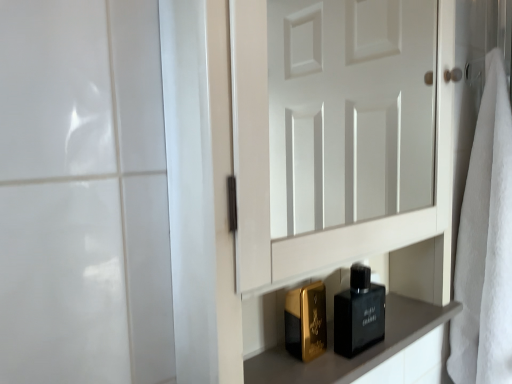
Question: From the image's perspective, is matte black perfume bottles at lower center beneath white soft towel at right?

Choices:
 (A) yes
 (B) no

Answer: (A)

Question: From a real-world perspective, does matte black perfume bottles at lower center sit lower than white soft towel at right?

Choices:
 (A) no
 (B) yes

Answer: (B)

Question: Is matte black perfume bottles at lower center facing away from white soft towel at right?

Choices:
 (A) no
 (B) yes

Answer: (A)

Question: Is matte black perfume bottles at lower center thinner than white soft towel at right?

Choices:
 (A) yes
 (B) no

Answer: (A)

Question: Considering the relative sizes of matte black perfume bottles at lower center and white soft towel at right in the image provided, is matte black perfume bottles at lower center shorter than white soft towel at right?

Choices:
 (A) no
 (B) yes

Answer: (B)

Question: Is matte black perfume bottles at lower center closer to camera compared to white soft towel at right?

Choices:
 (A) no
 (B) yes

Answer: (B)

Question: Is matte black perfume bottles at lower center further to camera compared to black glass perfume at lower center?

Choices:
 (A) yes
 (B) no

Answer: (B)

Question: Is the position of matte black perfume bottles at lower center less distant than that of black glass perfume at lower center?

Choices:
 (A) no
 (B) yes

Answer: (B)

Question: Is matte black perfume bottles at lower center positioned beyond the bounds of black glass perfume at lower center?

Choices:
 (A) no
 (B) yes

Answer: (B)

Question: Is matte black perfume bottles at lower center far from black glass perfume at lower center?

Choices:
 (A) yes
 (B) no

Answer: (B)

Question: From a real-world perspective, is matte black perfume bottles at lower center located higher than black glass perfume at lower center?

Choices:
 (A) no
 (B) yes

Answer: (A)

Question: Is matte black perfume bottles at lower center at the right side of black glass perfume at lower center?

Choices:
 (A) no
 (B) yes

Answer: (B)

Question: Can you confirm if black glass perfume at lower center is wider than white soft towel at right?

Choices:
 (A) no
 (B) yes

Answer: (A)